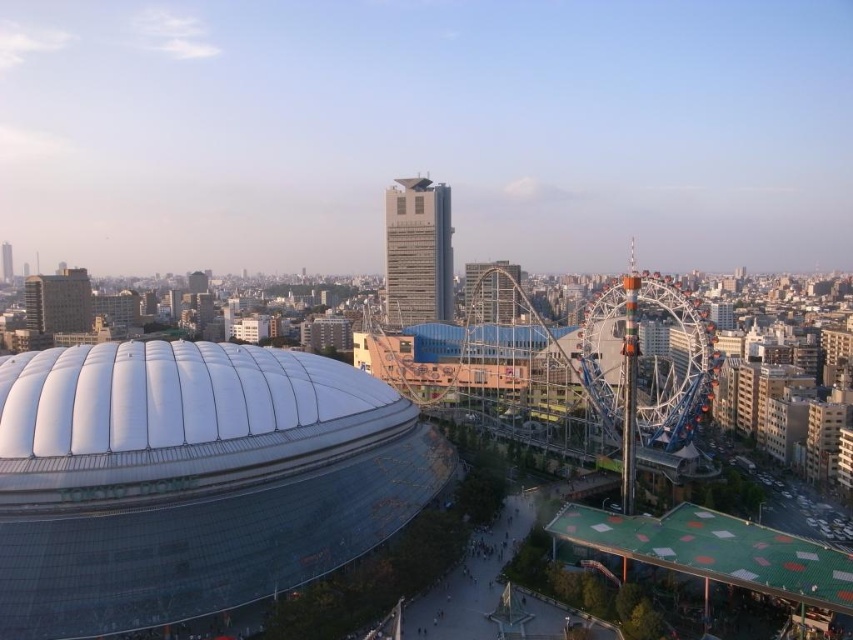
Question: Considering the relative positions of transparent glass dome at center and multicolored metallic ferris wheel at right in the image provided, where is transparent glass dome at center located with respect to multicolored metallic ferris wheel at right?

Choices:
 (A) below
 (B) above

Answer: (B)

Question: Is transparent glass dome at center above multicolored metallic ferris wheel at right?

Choices:
 (A) yes
 (B) no

Answer: (A)

Question: Is transparent glass dome at center positioned at the back of multicolored metallic ferris wheel at right?

Choices:
 (A) no
 (B) yes

Answer: (A)

Question: Which of the following is the closest to the observer?

Choices:
 (A) multicolored metallic ferris wheel at right
 (B) transparent glass dome at center

Answer: (B)

Question: Which point is farther to the camera?

Choices:
 (A) transparent glass dome at center
 (B) multicolored metallic ferris wheel at right

Answer: (B)